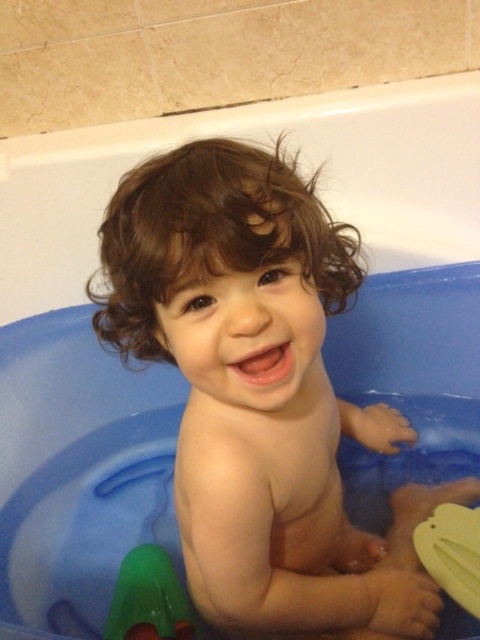
Looking at this image, can you confirm if smooth skin baby at center is smaller than yellow rubber duck at lower right?

No, smooth skin baby at center is not smaller than yellow rubber duck at lower right.

What do you see at coordinates (260, 394) in the screenshot? I see `smooth skin baby at center` at bounding box center [260, 394].

You are a GUI agent. You are given a task and a screenshot of the screen. Output one action in this format:
    pyautogui.click(x=<x>, y=<y>)
    Task: Click on the smooth skin baby at center
    
    Given the screenshot: What is the action you would take?
    pyautogui.click(x=260, y=394)

Which is more to the right, green rubber toy at lower left or yellow rubber duck at lower right?

yellow rubber duck at lower right is more to the right.

This screenshot has height=640, width=480. Describe the element at coordinates (148, 600) in the screenshot. I see `green rubber toy at lower left` at that location.

Between point (182, 636) and point (479, 515), which one is positioned behind?

Positioned behind is point (182, 636).

This screenshot has width=480, height=640. I want to click on green rubber toy at lower left, so click(x=148, y=600).

Between point (365, 564) and point (112, 608), which one is positioned in front?

Positioned in front is point (365, 564).

Does point (260, 356) come behind point (148, 576)?

No, it is in front of (148, 576).

Which is behind, point (225, 248) or point (108, 628)?

The point (108, 628) is behind.

Image resolution: width=480 pixels, height=640 pixels. Find the location of `smooth skin baby at center`. smooth skin baby at center is located at coordinates (260, 394).